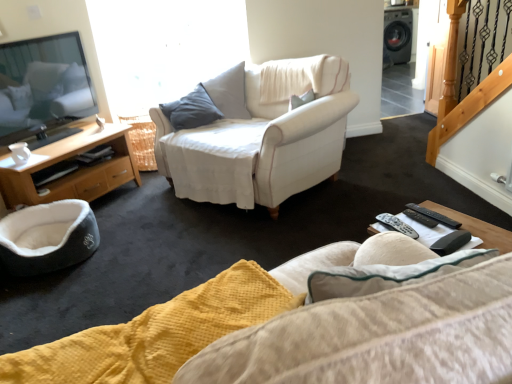
The width and height of the screenshot is (512, 384). In order to click on free area in between wooden cabinet at left and dark gray plush pet bed at lower left in this screenshot , I will do `click(114, 215)`.